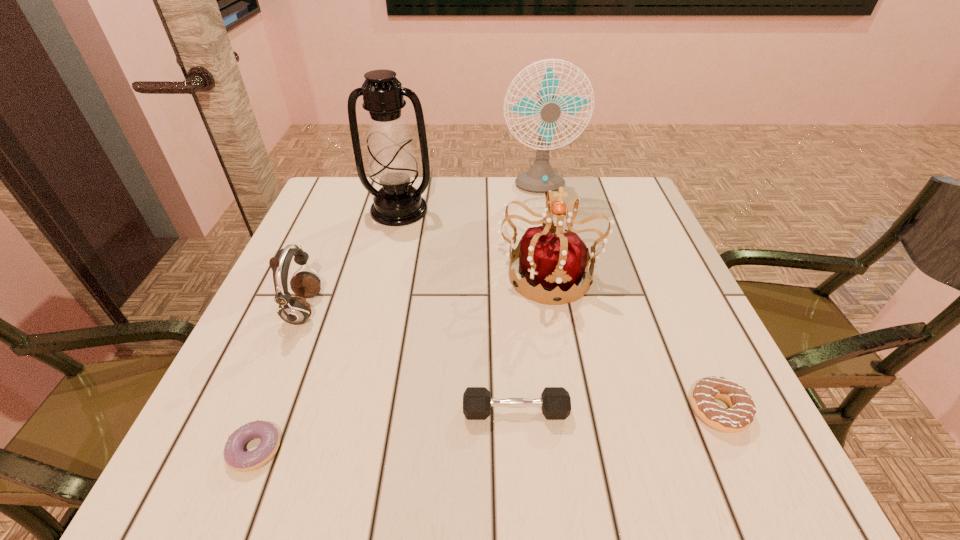
I want to click on free space at the far right corner of the desktop, so click(x=624, y=222).

This screenshot has width=960, height=540. Find the location of `unoccupied position between the third object from left to right and the fifth shortest object`. unoccupied position between the third object from left to right and the fifth shortest object is located at coordinates (474, 241).

Where is `vacant region between the fourth tallest object and the fifth shortest object`? vacant region between the fourth tallest object and the fifth shortest object is located at coordinates (426, 291).

You are a GUI agent. You are given a task and a screenshot of the screen. Output one action in this format:
    pyautogui.click(x=<x>, y=<y>)
    Task: Click on the free space that is in between the tiara and the shorter doughnut
    Image resolution: width=960 pixels, height=540 pixels.
    Given the screenshot: What is the action you would take?
    pyautogui.click(x=402, y=361)

This screenshot has height=540, width=960. I want to click on free space between the third shortest object and the fan, so click(527, 300).

I want to click on free space between the earphone and the shorter doughnut, so click(279, 380).

What are the coordinates of `free point between the oil lamp and the left doughnut` in the screenshot? It's located at (327, 330).

Where is `vacant area that lies between the dumbbell and the fourth tallest object`? The image size is (960, 540). vacant area that lies between the dumbbell and the fourth tallest object is located at coordinates (410, 360).

I want to click on free space between the right doughnut and the earphone, so click(511, 360).

Find the location of a particular element. The height and width of the screenshot is (540, 960). vacant point located between the shortest object and the tiara is located at coordinates (402, 361).